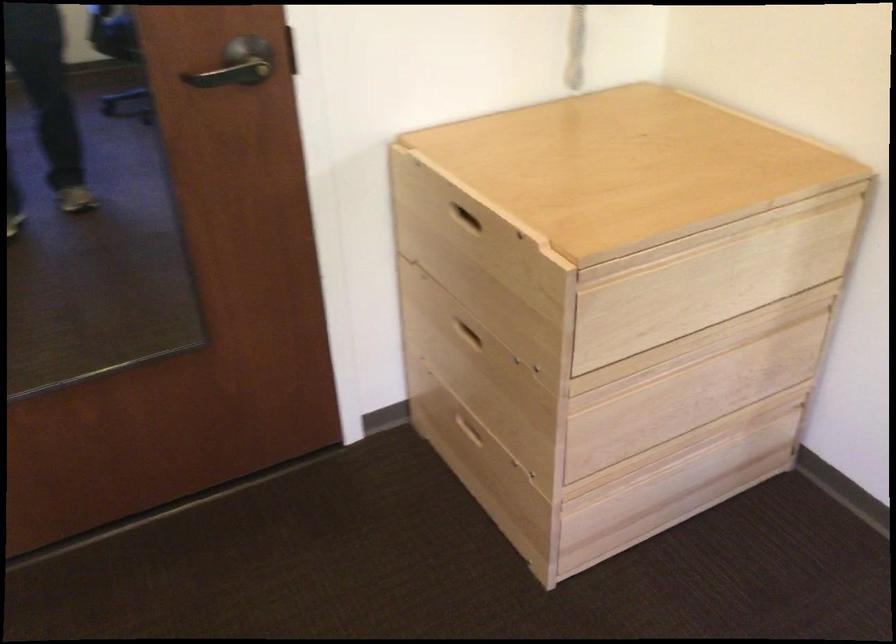
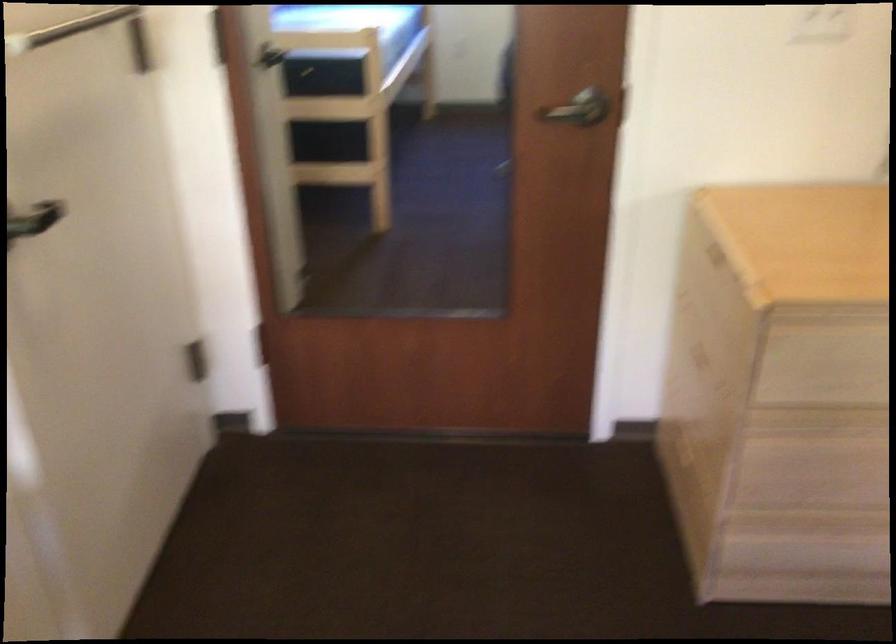
In the second image, find the point that corresponds to (x=253, y=67) in the first image.

(583, 111)